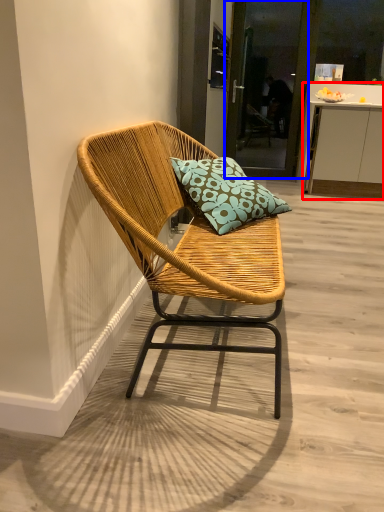
Question: Which object is further to the camera taking this photo, cabinetry (highlighted by a red box) or screen door (highlighted by a blue box)?

Choices:
 (A) cabinetry
 (B) screen door

Answer: (B)